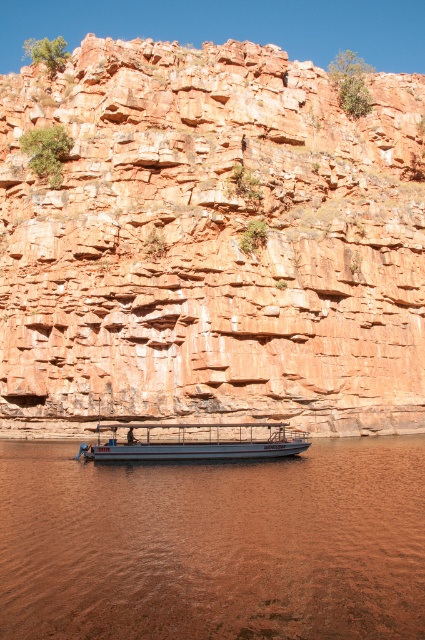
Question: Which object is positioned farthest from the brown matte water at lower center?

Choices:
 (A) metallic gray boat at center
 (B) matte orange rock at center

Answer: (B)

Question: From the image, what is the correct spatial relationship of brown matte water at lower center in relation to metallic gray boat at center?

Choices:
 (A) below
 (B) above

Answer: (A)

Question: Estimate the real-world distances between objects in this image. Which object is farther from the matte orange rock at center?

Choices:
 (A) brown matte water at lower center
 (B) metallic gray boat at center

Answer: (A)

Question: Which point is farther to the camera?

Choices:
 (A) metallic gray boat at center
 (B) brown matte water at lower center
 (C) matte orange rock at center

Answer: (C)

Question: Is matte orange rock at center to the right of brown matte water at lower center from the viewer's perspective?

Choices:
 (A) no
 (B) yes

Answer: (B)

Question: Does matte orange rock at center lie behind brown matte water at lower center?

Choices:
 (A) no
 (B) yes

Answer: (B)